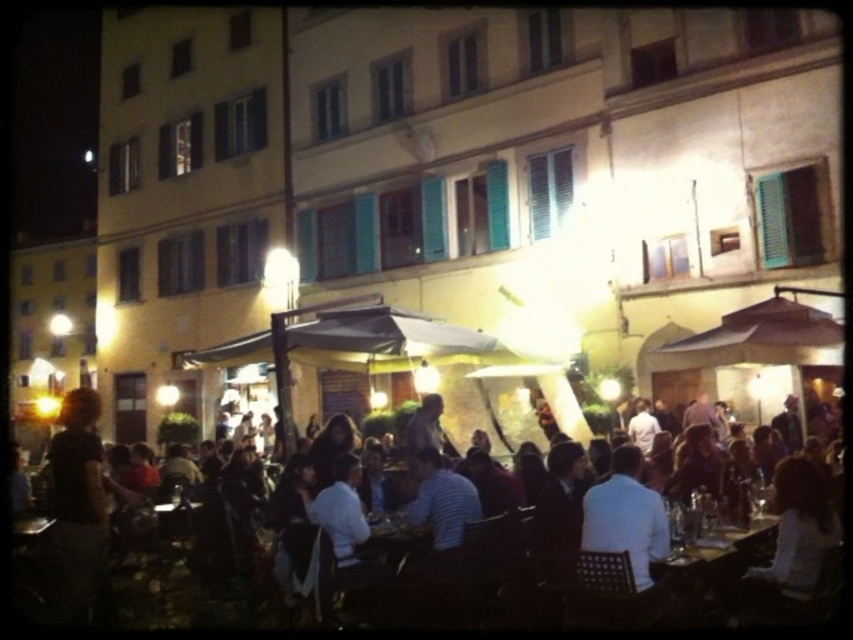
Question: Can you confirm if dark brown leather jacket at center is positioned below white shirt at center?

Choices:
 (A) no
 (B) yes

Answer: (B)

Question: Considering the real-world distances, which object is closest to the dark brown leather jacket at center?

Choices:
 (A) white shirt at center
 (B) wooden table at center

Answer: (A)

Question: Can you confirm if white shirt at center is smaller than wooden table at center?

Choices:
 (A) yes
 (B) no

Answer: (A)

Question: Which point is closer to the camera taking this photo?

Choices:
 (A) (757, 528)
 (B) (502, 595)
 (C) (647, 554)

Answer: (C)

Question: Is dark brown leather jacket at center further to the viewer compared to wooden table at center?

Choices:
 (A) no
 (B) yes

Answer: (A)

Question: Which point appears closest to the camera in this image?

Choices:
 (A) (33, 596)
 (B) (757, 532)

Answer: (B)